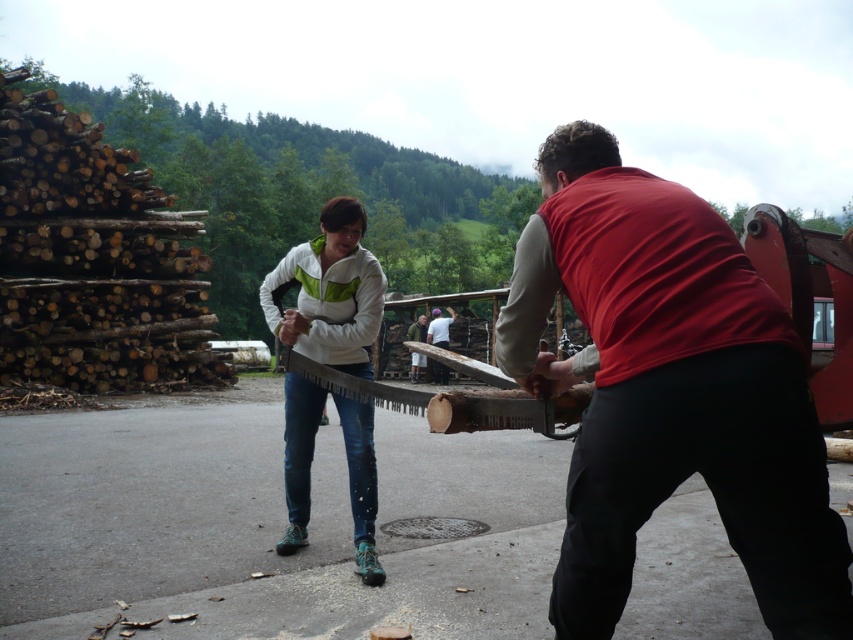
Question: Is matte red vest at center behind wooden saw at center?

Choices:
 (A) yes
 (B) no

Answer: (B)

Question: Which object is farther from the camera taking this photo?

Choices:
 (A) white matte jacket at center
 (B) white fabric shirt at center

Answer: (B)

Question: Can you confirm if matte red vest at center is positioned to the right of wooden saw at center?

Choices:
 (A) yes
 (B) no

Answer: (A)

Question: Which point is closer to the camera taking this photo?

Choices:
 (A) (645, 243)
 (B) (433, 321)
 (C) (373, 506)

Answer: (A)

Question: Which object is positioned farthest from the matte red vest at center?

Choices:
 (A) wooden saw at center
 (B) white fabric shirt at center

Answer: (A)

Question: Is matte red vest at center above white fabric shirt at center?

Choices:
 (A) no
 (B) yes

Answer: (A)